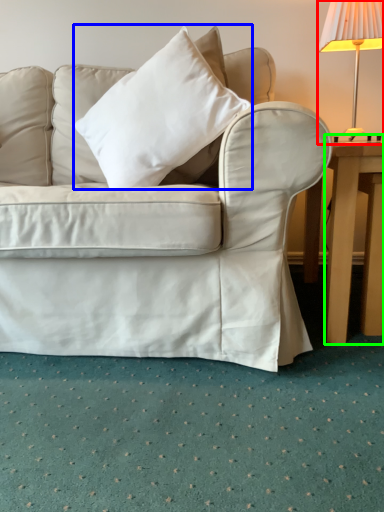
Question: Estimate the real-world distances between objects in this image. Which object is farther from lamp (highlighted by a red box), pillow (highlighted by a blue box) or table (highlighted by a green box)?

Choices:
 (A) pillow
 (B) table

Answer: (A)